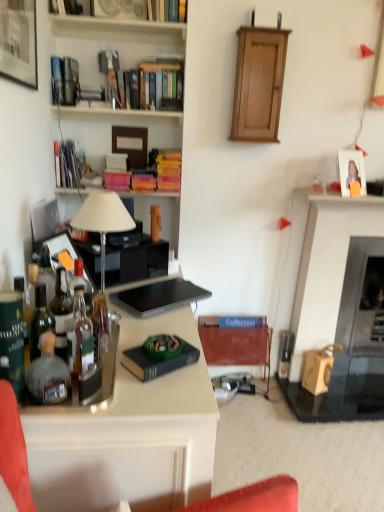
Identify the location of vacant region to the left of hardcover book at upper center, placed as the 1th book when sorted from top to bottom. (127, 23).